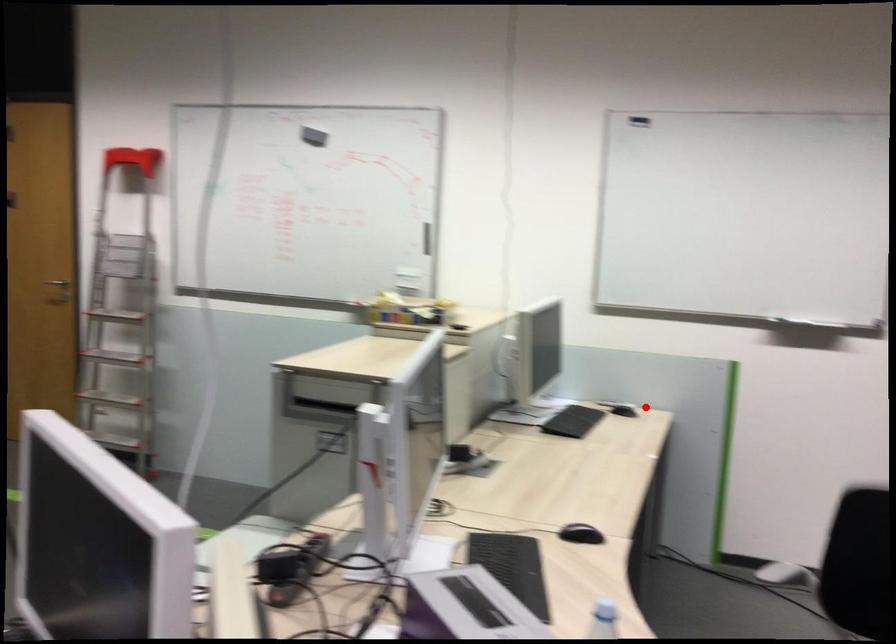
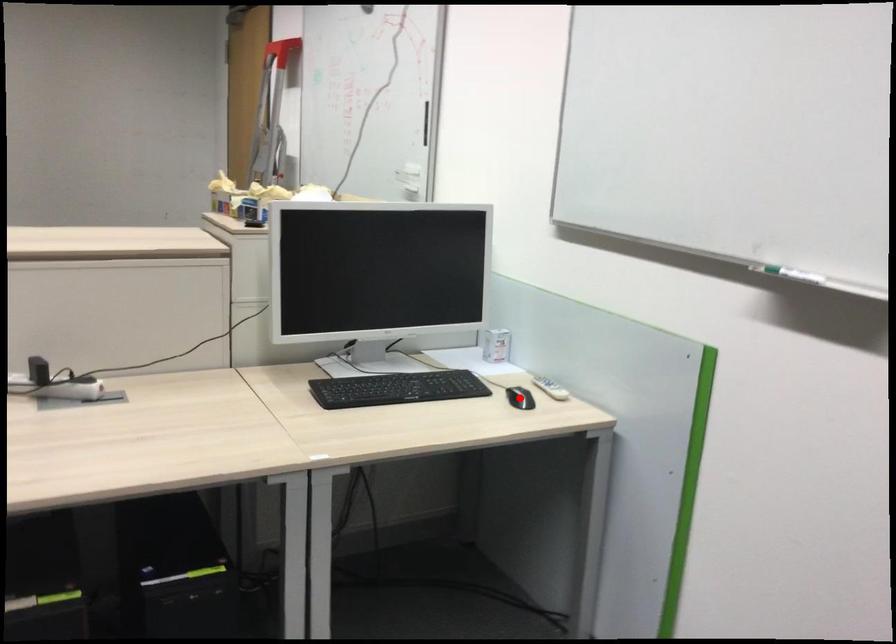
I am providing you with two images of the same scene from different viewpoints. A red point is marked on the first image and another point is marked on the second image. Is the marked point in image1 the same physical position as the marked point in image2?

Yes